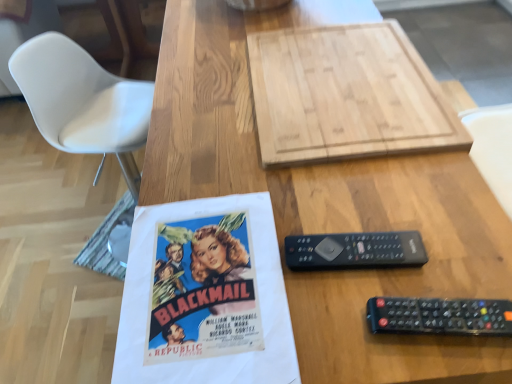
Find the location of a particular element. This screenshot has height=384, width=512. vacant area on top of natural wood cutting board at upper center (from a real-world perspective) is located at coordinates (318, 92).